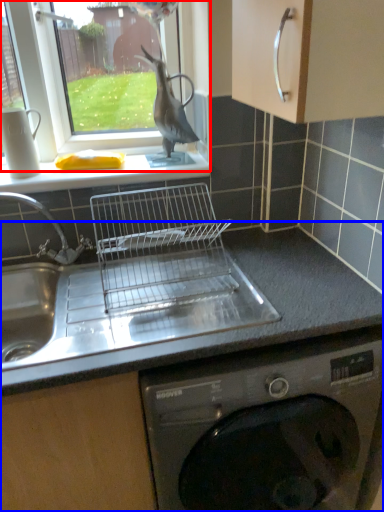
Question: Which object appears farthest to the camera in this image, window (highlighted by a red box) or countertop (highlighted by a blue box)?

Choices:
 (A) window
 (B) countertop

Answer: (A)